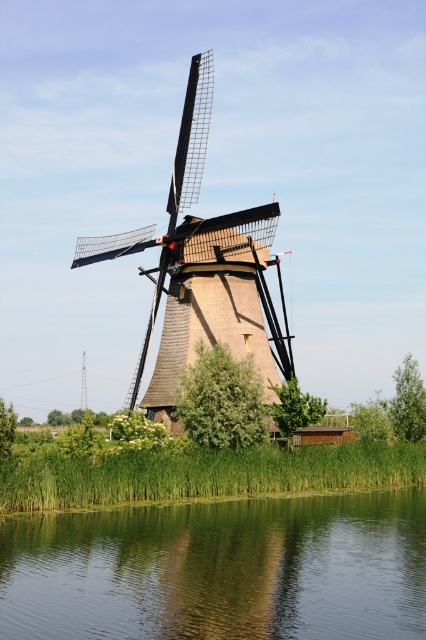
Can you confirm if green smooth water at lower center is taller than green grass at lower center?

Incorrect, green smooth water at lower center's height is not larger of green grass at lower center's.

Between green smooth water at lower center and green grass at lower center, which one is positioned higher?

green grass at lower center

Locate an element on the screen. The image size is (426, 640). green smooth water at lower center is located at coordinates (219, 570).

You are a GUI agent. You are given a task and a screenshot of the screen. Output one action in this format:
    pyautogui.click(x=<x>, y=<y>)
    Task: Click on the green smooth water at lower center
    This screenshot has width=426, height=640.
    Given the screenshot: What is the action you would take?
    pyautogui.click(x=219, y=570)

Is the position of wooden windmill at center less distant than that of green grass at lower center?

No, wooden windmill at center is further to the viewer.

Which is in front, point (261, 273) or point (20, 477)?

Positioned in front is point (20, 477).

The height and width of the screenshot is (640, 426). Find the location of `wooden windmill at center`. wooden windmill at center is located at coordinates (204, 269).

Is green smooth water at lower center to the right of wooden windmill at center from the viewer's perspective?

Yes, green smooth water at lower center is to the right of wooden windmill at center.

Does green smooth water at lower center appear on the left side of wooden windmill at center?

Incorrect, green smooth water at lower center is not on the left side of wooden windmill at center.

Does point (368, 536) come in front of point (186, 168)?

Yes, point (368, 536) is closer to viewer.

The height and width of the screenshot is (640, 426). Find the location of `green smooth water at lower center`. green smooth water at lower center is located at coordinates (219, 570).